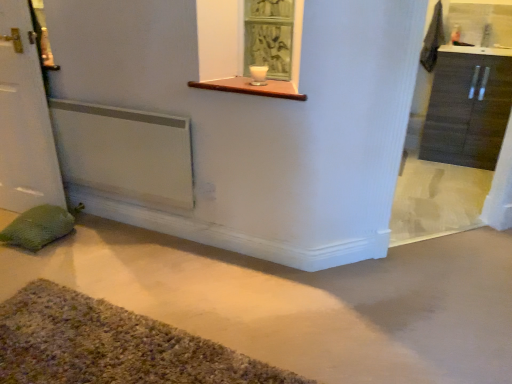
Question: Is smooth concrete floor at center inside or outside of white matte door at left?

Choices:
 (A) outside
 (B) inside

Answer: (A)

Question: Considering their positions, is smooth concrete floor at center located in front of or behind white matte door at left?

Choices:
 (A) front
 (B) behind

Answer: (A)

Question: Considering the real-world distances, which object is closest to the dark wood cabinet at right?

Choices:
 (A) wooden at upper center
 (B) white matte door at left
 (C) smooth concrete floor at center
 (D) multicolored shaggy bath mat at lower left
 (E) white ceramic bowl at upper center

Answer: (C)

Question: Which is nearer to the smooth concrete floor at center?

Choices:
 (A) dark wood cabinet at right
 (B) white matte door at left
 (C) multicolored shaggy bath mat at lower left
 (D) wooden at upper center
 (E) white ceramic bowl at upper center

Answer: (C)